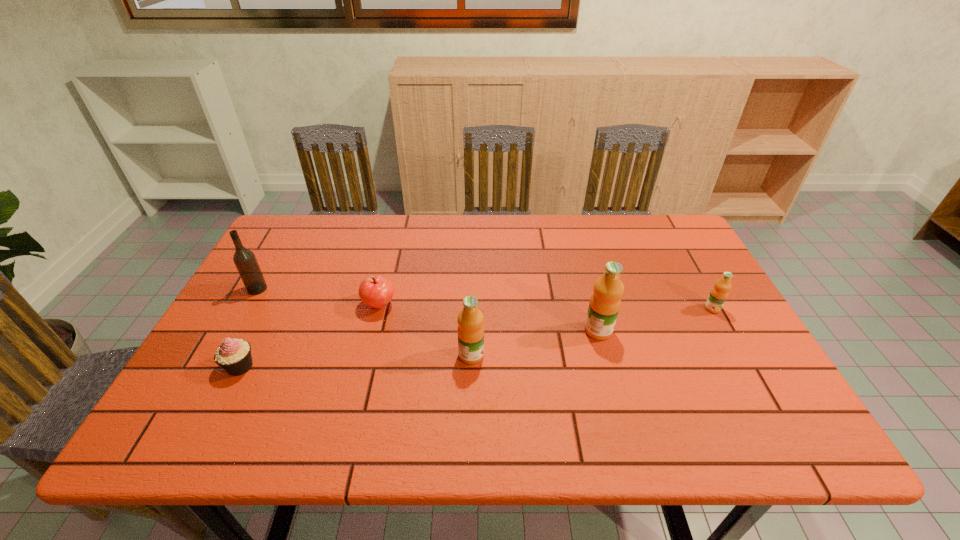
Please point a vacant point for placing a orange juice on the left. Please provide its 2D coordinates. Your answer should be formatted as a tuple, i.e. [(x, y)], where the tuple contains the x and y coordinates of a point satisfying the conditions above.

[(329, 383)]